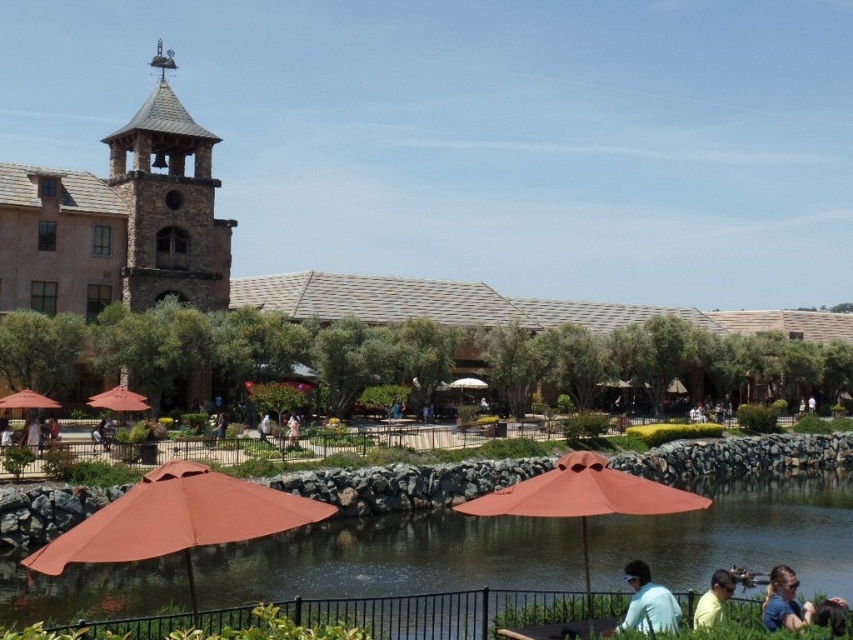
Question: Estimate the real-world distances between objects in this image. Which object is farther from the light blue shirt at lower right?

Choices:
 (A) yellow matte shirt at lower right
 (B) brown stone tower at upper left
 (C) terracotta fabric umbrella at center

Answer: (B)

Question: Which point is closer to the camera?

Choices:
 (A) (780, 592)
 (B) (45, 401)

Answer: (A)

Question: Does terracotta fabric umbrella at center appear on the right side of white fabric dress at center?

Choices:
 (A) no
 (B) yes

Answer: (B)

Question: Is light blue shirt at lower right thinner than white fabric dress at center?

Choices:
 (A) yes
 (B) no

Answer: (B)

Question: Among these points, which one is nearest to the camera?

Choices:
 (A) (466, 381)
 (B) (137, 406)

Answer: (B)

Question: Is brown stone river at center to the left of light blue shirt at lower right from the viewer's perspective?

Choices:
 (A) no
 (B) yes

Answer: (A)